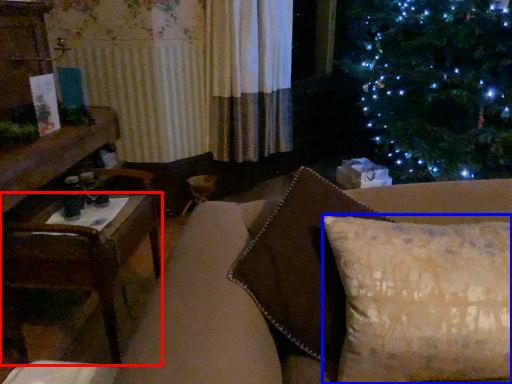
Question: Which of the following is the closest to the observer, table (highlighted by a red box) or pillow (highlighted by a blue box)?

Choices:
 (A) table
 (B) pillow

Answer: (B)